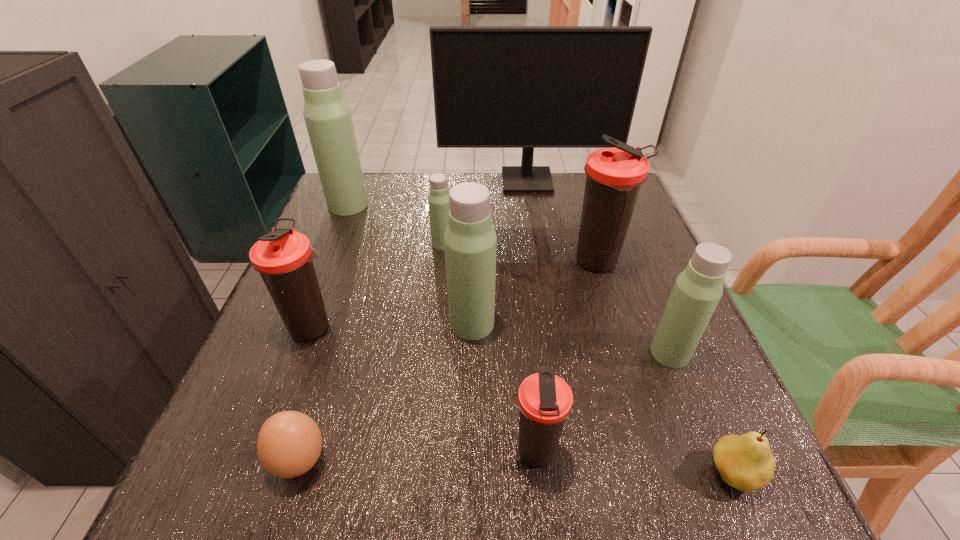
Identify the location of vacant space that satisfies the following two spatial constraints: 1. on the front-facing side of the farthest object; 2. on the left side of the farthest brown thermos bottle. (540, 262).

Where is `vacant space that satisfies the following two spatial constraints: 1. on the front side of the pear; 2. on the left side of the boiled egg`? The height and width of the screenshot is (540, 960). vacant space that satisfies the following two spatial constraints: 1. on the front side of the pear; 2. on the left side of the boiled egg is located at coordinates (296, 474).